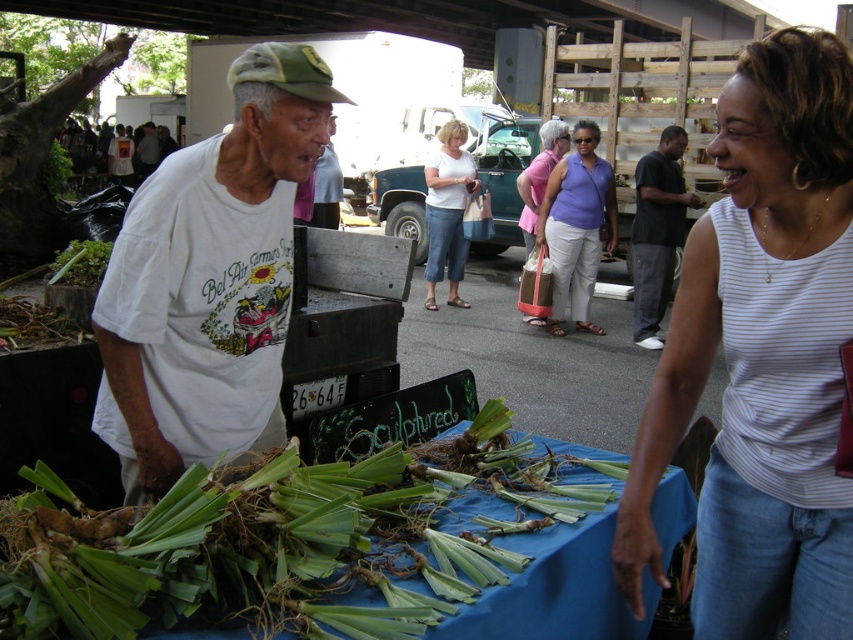
Question: Which object appears closest to the camera in this image?

Choices:
 (A) white striped tank top at upper right
 (B) pink fabric bag at center
 (C) white cotton tank top at center

Answer: (A)

Question: Does purple fabric shirt at center lie behind pink fabric bag at center?

Choices:
 (A) yes
 (B) no

Answer: (B)

Question: Is white cotton t-shirt at center above purple fabric shirt at center?

Choices:
 (A) no
 (B) yes

Answer: (A)

Question: Which object is positioned farthest from the green leafy vegetables at center?

Choices:
 (A) white cotton tank top at center
 (B) white striped tank top at upper right
 (C) white cotton t-shirt at center

Answer: (A)

Question: Does white cotton t-shirt at center have a larger size compared to purple fabric shirt at center?

Choices:
 (A) yes
 (B) no

Answer: (B)

Question: Which point is closer to the camera?

Choices:
 (A) dark gray t-shirt at left
 (B) white cotton tank top at center
 (C) green leafy vegetables at center
 (D) white cotton t-shirt at center

Answer: (C)